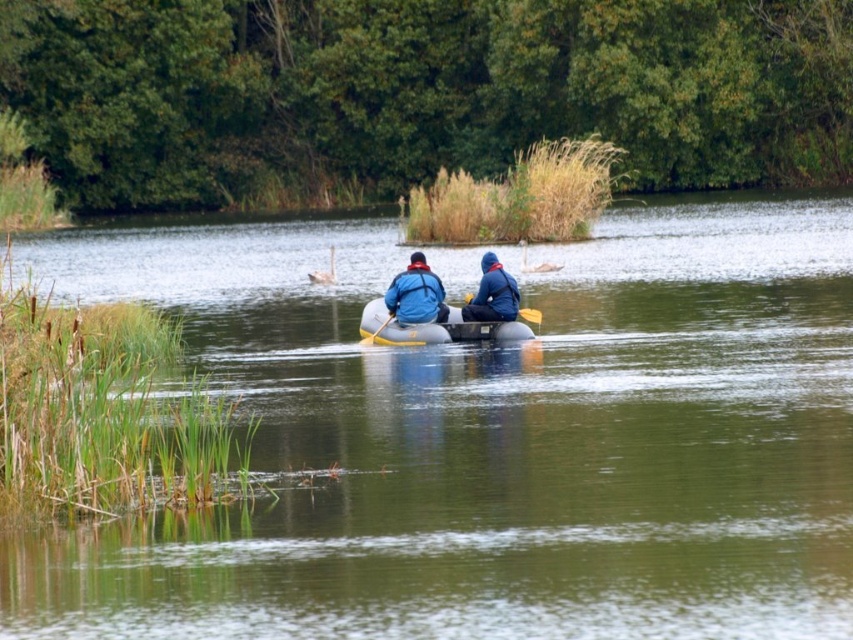
Question: Estimate the real-world distances between objects in this image. Which object is closer to the yellow wood paddle at center?

Choices:
 (A) blue matte jacket at center
 (B) green rubber raft at center

Answer: (A)

Question: Is green rubber raft at center thinner than yellow wood paddle at center?

Choices:
 (A) no
 (B) yes

Answer: (A)

Question: Which object is farther from the camera taking this photo?

Choices:
 (A) blue matte jacket at center
 (B) yellow rubber paddle at center

Answer: (B)

Question: Is green rubber raft at center closer to camera compared to yellow rubber paddle at center?

Choices:
 (A) no
 (B) yes

Answer: (B)

Question: Which object appears closest to the camera in this image?

Choices:
 (A) yellow rubber paddle at center
 (B) yellow wood paddle at center
 (C) green rubber raft at center

Answer: (C)

Question: Does blue fabric jacket at center have a larger size compared to blue matte jacket at center?

Choices:
 (A) no
 (B) yes

Answer: (A)